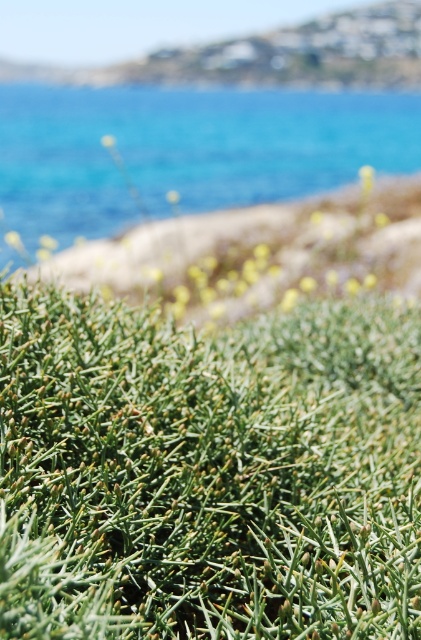
Can you confirm if blue water at upper center is positioned above green spiky plant at lower center?

Yes, blue water at upper center is above green spiky plant at lower center.

Does blue water at upper center have a greater height compared to green spiky plant at lower center?

Indeed, blue water at upper center has a greater height compared to green spiky plant at lower center.

Does point (210, 90) come farther from viewer compared to point (112, 266)?

Yes, it is.

Find the location of `blue water at upper center`. blue water at upper center is located at coordinates [x=186, y=150].